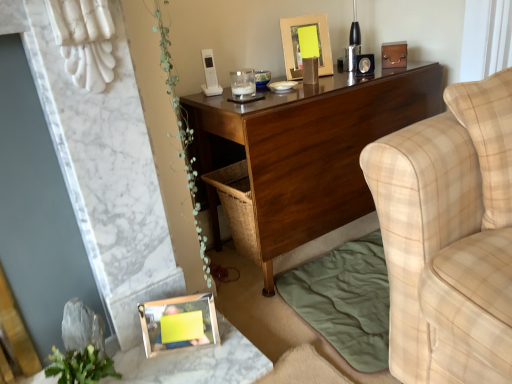
Question: Is dark wood desk at center placed right next to gold metallic picture frame at upper center, the 2th picture frame from the bottom?

Choices:
 (A) no
 (B) yes

Answer: (A)

Question: Is dark wood desk at center further to camera compared to gold metallic picture frame at upper center, marked as the first picture frame in a right-to-left arrangement?

Choices:
 (A) yes
 (B) no

Answer: (B)

Question: Is dark wood desk at center positioned far away from gold metallic picture frame at upper center, acting as the 1th picture frame starting from the top?

Choices:
 (A) no
 (B) yes

Answer: (A)

Question: From a real-world perspective, does dark wood desk at center stand above gold metallic picture frame at upper center, which is counted as the first picture frame, starting from the back?

Choices:
 (A) yes
 (B) no

Answer: (B)

Question: From a real-world perspective, is dark wood desk at center beneath gold metallic picture frame at upper center, which is counted as the first picture frame, starting from the back?

Choices:
 (A) no
 (B) yes

Answer: (B)

Question: Is dark wood desk at center taller than gold metallic picture frame at upper center, acting as the 1th picture frame starting from the top?

Choices:
 (A) yes
 (B) no

Answer: (A)

Question: Is wooden frame at lower left completely or partially inside green leafy plant at lower left?

Choices:
 (A) no
 (B) yes

Answer: (A)

Question: Does green leafy plant at lower left have a larger size compared to wooden frame at lower left?

Choices:
 (A) no
 (B) yes

Answer: (A)

Question: From the image's perspective, does green leafy plant at lower left appear higher than wooden frame at lower left?

Choices:
 (A) no
 (B) yes

Answer: (B)

Question: Is green leafy plant at lower left oriented away from wooden frame at lower left?

Choices:
 (A) no
 (B) yes

Answer: (A)

Question: Considering the relative positions of green leafy plant at lower left and wooden frame at lower left in the image provided, is green leafy plant at lower left in front of wooden frame at lower left?

Choices:
 (A) no
 (B) yes

Answer: (A)

Question: Is green leafy plant at lower left at the right side of wooden frame at lower left?

Choices:
 (A) yes
 (B) no

Answer: (B)

Question: Can we say dark wood desk at center lies outside green leafy plant at lower left?

Choices:
 (A) no
 (B) yes

Answer: (B)